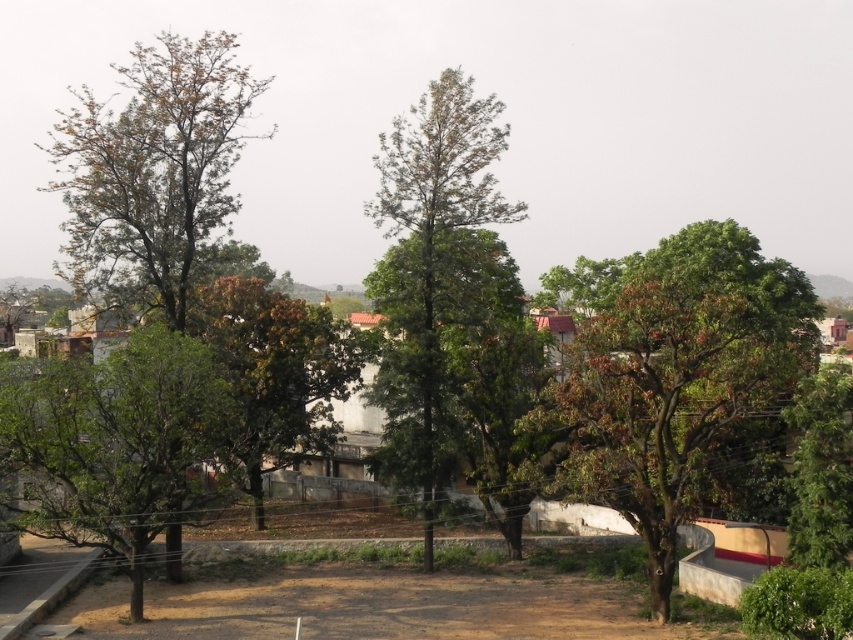
Between brown textured tree at left and brown textured tree at center, which one has less height?

With less height is brown textured tree at center.

Locate an element on the screen. brown textured tree at left is located at coordinates (152, 172).

Where is `brown textured tree at left`? The width and height of the screenshot is (853, 640). brown textured tree at left is located at coordinates (152, 172).

Who is positioned more to the right, green leafy tree at right or green leafy tree at left?

From the viewer's perspective, green leafy tree at right appears more on the right side.

Is green leafy tree at right thinner than green leafy tree at left?

Incorrect, green leafy tree at right's width is not less than green leafy tree at left's.

I want to click on green leafy tree at right, so click(x=672, y=394).

The image size is (853, 640). Identify the location of green leafy tree at right. [672, 394].

Who is positioned more to the right, green leafy tree at right or green leafy tree at center?

green leafy tree at right is more to the right.

The width and height of the screenshot is (853, 640). What are the coordinates of `green leafy tree at right` in the screenshot? It's located at (672, 394).